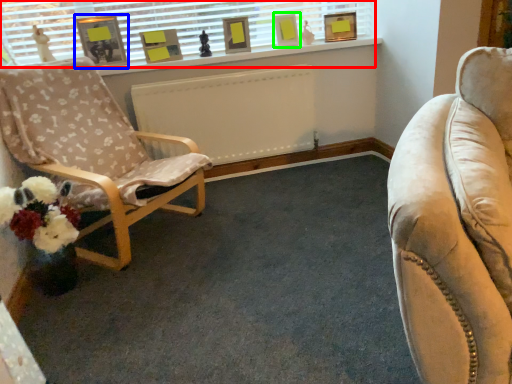
Question: Based on their relative distances, which object is farther from window (highlighted by a red box)? Choose from picture frame (highlighted by a blue box) and picture frame (highlighted by a green box).

Choices:
 (A) picture frame
 (B) picture frame

Answer: (B)